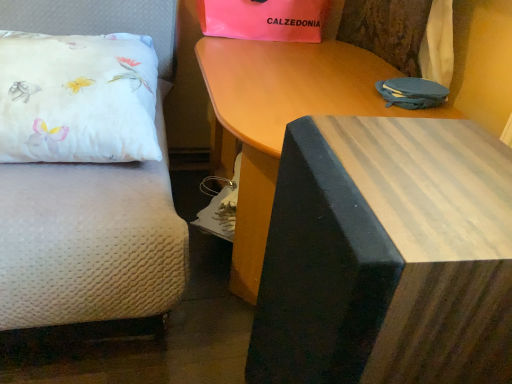
Question: Does wooden table at upper center, which is the 2th table from front to back, come behind wooden table at center, the second table viewed from the back?

Choices:
 (A) yes
 (B) no

Answer: (A)

Question: Does wooden table at upper center, which is the 2th table from front to back, have a greater height compared to wooden table at center, the 1th table in the front-to-back sequence?

Choices:
 (A) no
 (B) yes

Answer: (A)

Question: Considering the relative positions of wooden table at upper center, which is the 2th table from front to back, and wooden table at center, the second table viewed from the back, in the image provided, is wooden table at upper center, which is the 2th table from front to back, to the right of wooden table at center, the second table viewed from the back, from the viewer's perspective?

Choices:
 (A) yes
 (B) no

Answer: (B)

Question: Can you confirm if wooden table at upper center, marked as the first table in a back-to-front arrangement, is thinner than wooden table at center, the second table viewed from the back?

Choices:
 (A) yes
 (B) no

Answer: (B)

Question: Can wooden table at center, the second table viewed from the back, be found inside wooden table at upper center, marked as the first table in a back-to-front arrangement?

Choices:
 (A) yes
 (B) no

Answer: (B)

Question: From a real-world perspective, is white satin pillow at left positioned above or below pink matte gift bag at upper center?

Choices:
 (A) below
 (B) above

Answer: (A)

Question: Considering their positions, is white satin pillow at left located in front of or behind pink matte gift bag at upper center?

Choices:
 (A) front
 (B) behind

Answer: (A)

Question: Considering the relative positions of white satin pillow at left and pink matte gift bag at upper center in the image provided, is white satin pillow at left to the left or to the right of pink matte gift bag at upper center?

Choices:
 (A) right
 (B) left

Answer: (B)

Question: Does point (120, 92) appear closer or farther from the camera than point (245, 0)?

Choices:
 (A) farther
 (B) closer

Answer: (B)

Question: Is pink matte gift bag at upper center in front of or behind wooden table at upper center, which is the 2th table from front to back, in the image?

Choices:
 (A) front
 (B) behind

Answer: (B)

Question: Looking at their shapes, would you say pink matte gift bag at upper center is wider or thinner than wooden table at upper center, which is the 2th table from front to back?

Choices:
 (A) wide
 (B) thin

Answer: (B)

Question: From their relative heights in the image, would you say pink matte gift bag at upper center is taller or shorter than wooden table at upper center, marked as the first table in a back-to-front arrangement?

Choices:
 (A) tall
 (B) short

Answer: (B)

Question: Considering the positions of point (286, 1) and point (228, 150), is point (286, 1) closer or farther from the camera than point (228, 150)?

Choices:
 (A) farther
 (B) closer

Answer: (B)

Question: Is point (283, 6) closer or farther from the camera than point (95, 74)?

Choices:
 (A) closer
 (B) farther

Answer: (B)

Question: Considering their positions, is pink matte gift bag at upper center located in front of or behind white satin pillow at left?

Choices:
 (A) front
 (B) behind

Answer: (B)